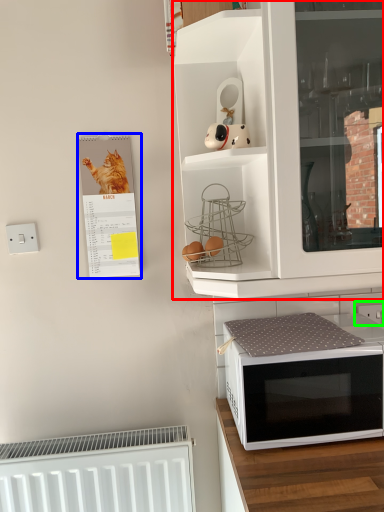
Question: Which object is positioned closest to cabinetry (highlighted by a red box)? Select from bulletin board (highlighted by a blue box) and electric outlet (highlighted by a green box).

Choices:
 (A) bulletin board
 (B) electric outlet

Answer: (A)